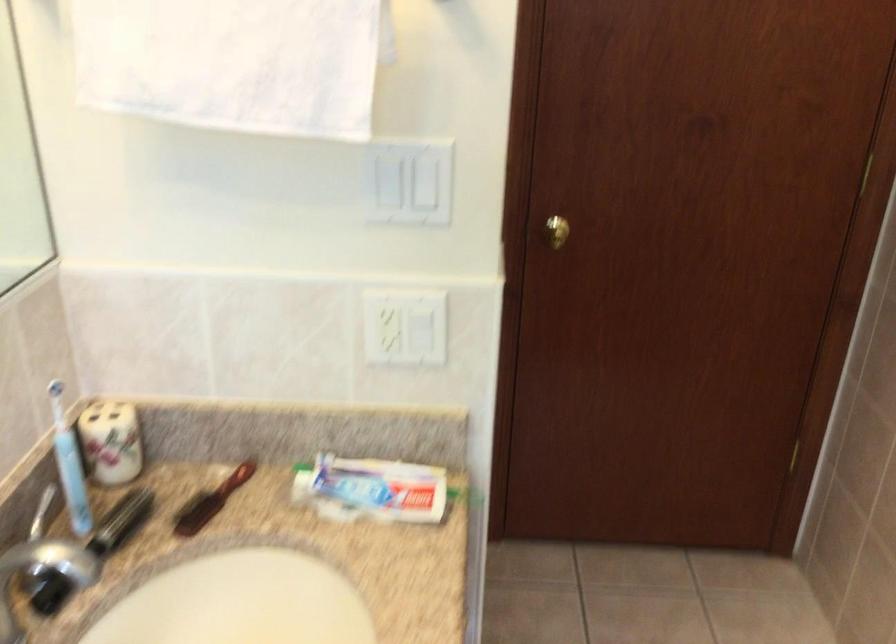
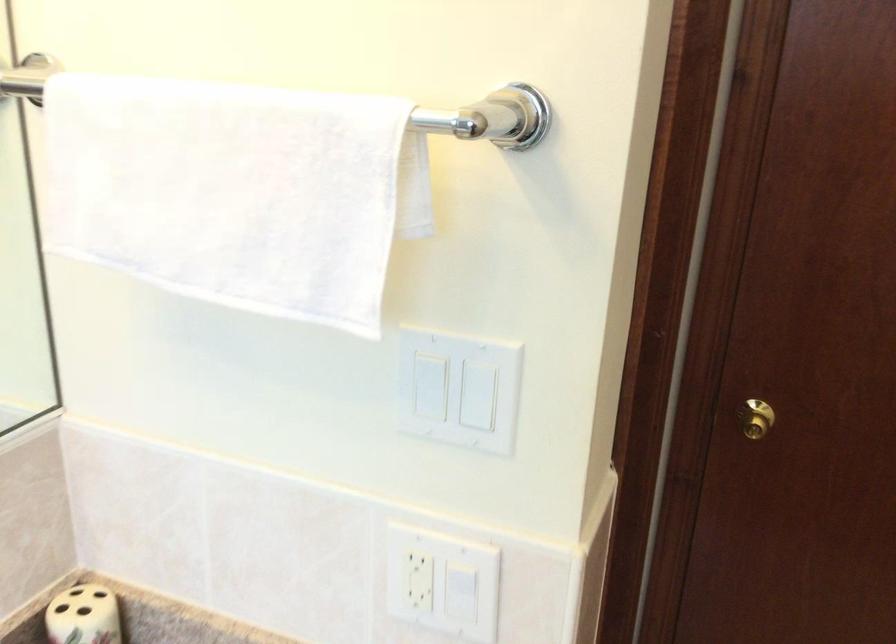
Locate, in the second image, the point that corresponds to pixel 423 182 in the first image.

(483, 395)